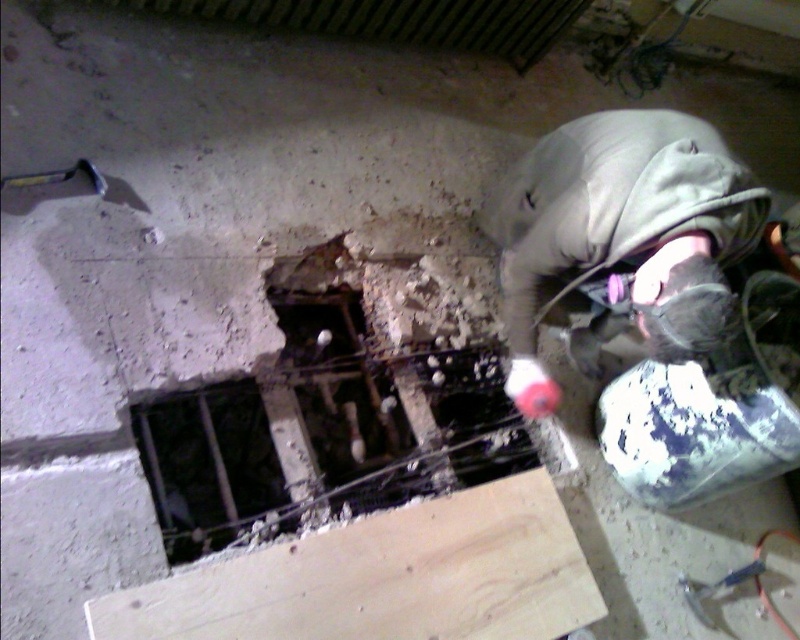
Question: Which of the following is the farthest from the observer?

Choices:
 (A) (433, 564)
 (B) (210, 529)
 (C) (716, 273)

Answer: (A)

Question: In this image, where is gray fabric construction worker at upper right located relative to dark metal bars at center?

Choices:
 (A) below
 (B) above

Answer: (B)

Question: Which point is farther to the camera?

Choices:
 (A) (466, 595)
 (B) (664, 212)
 (C) (164, 536)

Answer: (A)

Question: Can you confirm if gray fabric construction worker at upper right is smaller than dark metal bars at center?

Choices:
 (A) no
 (B) yes

Answer: (A)

Question: Among these objects, which one is nearest to the camera?

Choices:
 (A) gray fabric construction worker at upper right
 (B) light brown wood plank at lower center

Answer: (B)

Question: Is light brown wood plank at lower center bigger than gray fabric construction worker at upper right?

Choices:
 (A) no
 (B) yes

Answer: (A)